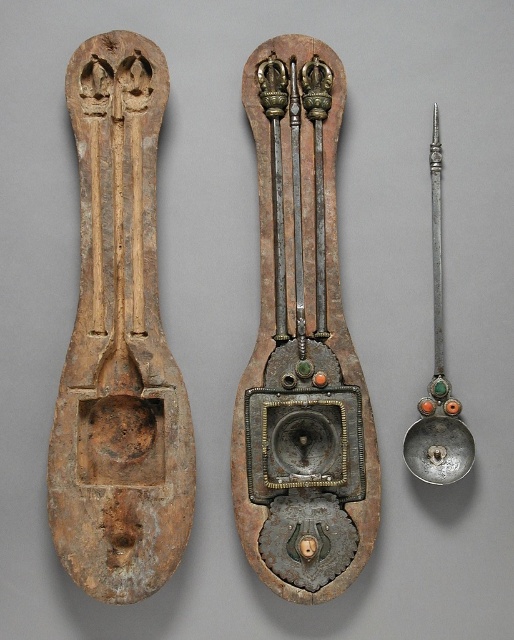
You are an archaeologist examining the artifacts in the image. You need to place both the brown wood spoon at center and the polished metal spoon at center into a storage box. The box has a single compartment that can only hold one spoon at a time. Which spoon should you place first to ensure the other can fit into the remaining space?

The brown wood spoon at center is located above the polished metal spoon at center, so you should place the brown wood spoon at center first to make space for the polished metal spoon at center in the remaining area.